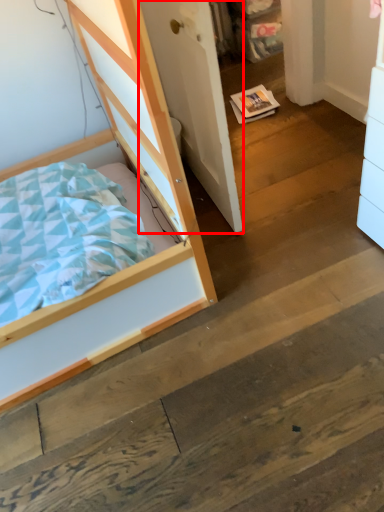
Question: From the image's perspective, where is door (annotated by the red box) located relative to bed?

Choices:
 (A) below
 (B) above

Answer: (B)